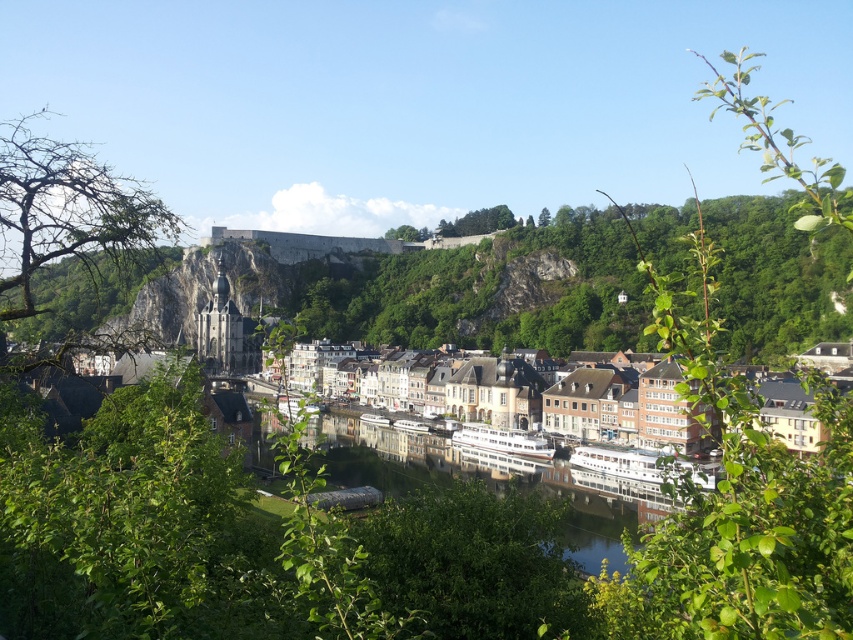
Question: Can you confirm if green leafy tree at left is wider than white brick buildings at center?

Choices:
 (A) no
 (B) yes

Answer: (B)

Question: Is white brick buildings at center wider than white glossy waterway at center?

Choices:
 (A) yes
 (B) no

Answer: (A)

Question: Estimate the real-world distances between objects in this image. Which object is closer to the green leafy tree at left?

Choices:
 (A) green leafy branch at upper right
 (B) white brick buildings at center
 (C) white glossy waterway at center

Answer: (B)

Question: Is green leafy branch at upper right above white glossy waterway at center?

Choices:
 (A) yes
 (B) no

Answer: (A)

Question: Which point is farther from the camera taking this photo?

Choices:
 (A) (459, 449)
 (B) (74, 141)

Answer: (B)

Question: Among these points, which one is nearest to the camera?

Choices:
 (A) (376, 426)
 (B) (654, 289)

Answer: (B)